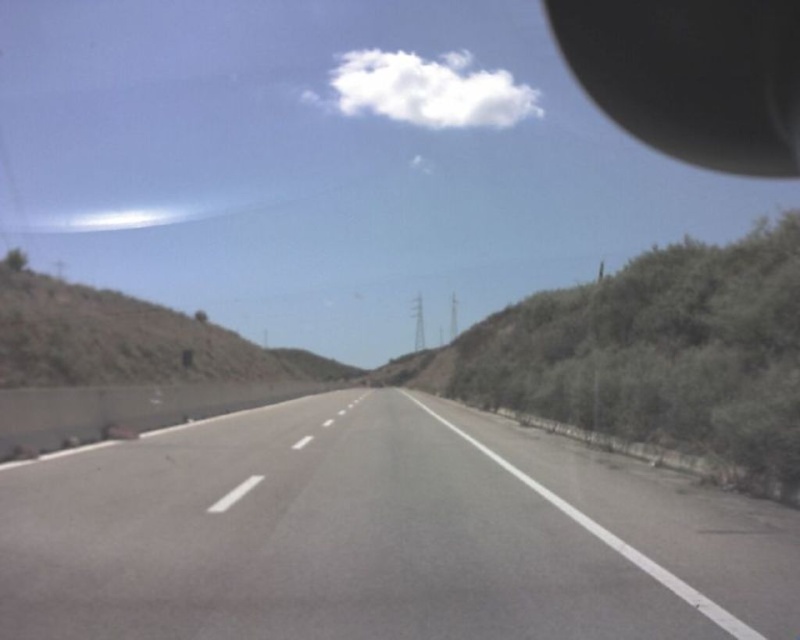
Question: Is gray asphalt highway at center behind black rubber view mirror at upper right?

Choices:
 (A) yes
 (B) no

Answer: (B)

Question: Is black rubber view mirror at upper right positioned behind dull brown dirt at left?

Choices:
 (A) no
 (B) yes

Answer: (B)

Question: Which object is farther from the camera taking this photo?

Choices:
 (A) gray asphalt highway at center
 (B) black rubber view mirror at upper right

Answer: (B)

Question: Among these objects, which one is nearest to the camera?

Choices:
 (A) dull brown dirt at left
 (B) black rubber view mirror at upper right
 (C) gray asphalt highway at center

Answer: (C)

Question: Estimate the real-world distances between objects in this image. Which object is farther from the dull brown dirt at left?

Choices:
 (A) gray asphalt highway at center
 (B) black rubber view mirror at upper right

Answer: (B)

Question: Does gray asphalt highway at center have a greater width compared to dull brown dirt at left?

Choices:
 (A) no
 (B) yes

Answer: (A)